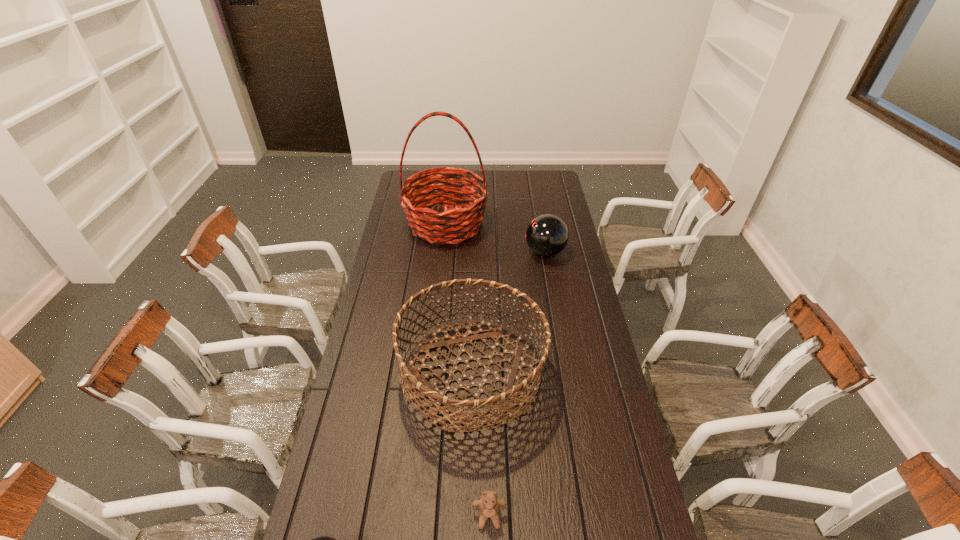
Identify the location of empty location between the third nearest object and the teddy bear. The width and height of the screenshot is (960, 540). (481, 445).

Locate an element on the screen. free spot between the taller basket and the farther bowling ball is located at coordinates [x=495, y=238].

Image resolution: width=960 pixels, height=540 pixels. Find the location of `object that stands as the third closest to the shortest object`. object that stands as the third closest to the shortest object is located at coordinates (547, 235).

Find the location of `object that stands as the fourth closest to the third tallest object`. object that stands as the fourth closest to the third tallest object is located at coordinates (323, 539).